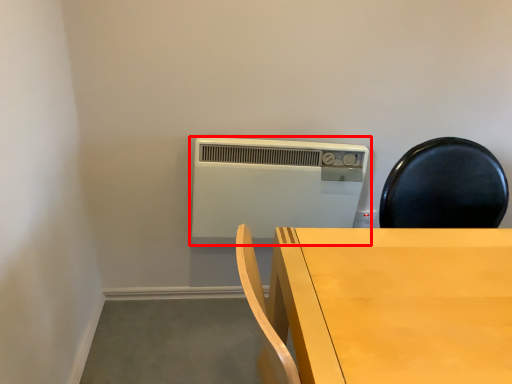
Question: From the image's perspective, where is home appliance (annotated by the red box) located in relation to table in the image?

Choices:
 (A) below
 (B) above

Answer: (B)